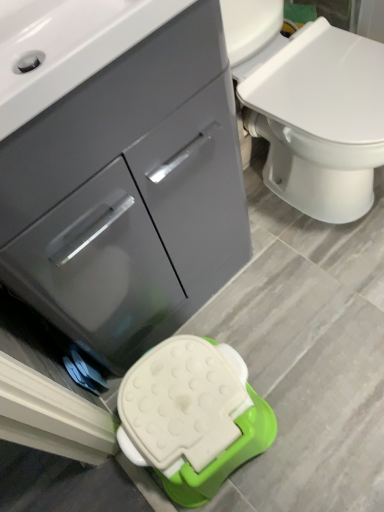
Question: Is white plastic stool at lower center taller or shorter than white glossy sink at upper left?

Choices:
 (A) tall
 (B) short

Answer: (A)

Question: Is white plastic stool at lower center wider or thinner than white glossy sink at upper left?

Choices:
 (A) thin
 (B) wide

Answer: (A)

Question: Estimate the real-world distances between objects in this image. Which object is farther from the white glossy sink at upper left?

Choices:
 (A) white plastic stool at lower center
 (B) matte gray cabinet at center

Answer: (A)

Question: Which is nearer to the white glossy sink at upper left?

Choices:
 (A) matte gray cabinet at center
 (B) white plastic stool at lower center

Answer: (A)